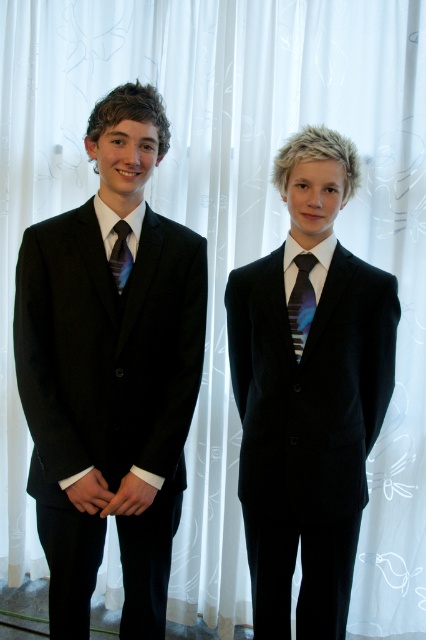
Question: Which point is closer to the camera?

Choices:
 (A) shiny blue tie at center
 (B) matte black suit at left
 (C) matte black tie at left

Answer: (B)

Question: Which point is farther to the camera?

Choices:
 (A) shiny blue tie at center
 (B) matte black suit at left
 (C) matte black suit at center

Answer: (A)

Question: Does matte black suit at left have a smaller size compared to shiny blue tie at center?

Choices:
 (A) no
 (B) yes

Answer: (A)

Question: Can you confirm if matte black suit at left is wider than matte black tie at left?

Choices:
 (A) yes
 (B) no

Answer: (A)

Question: Is matte black suit at left to the right of shiny blue tie at center from the viewer's perspective?

Choices:
 (A) no
 (B) yes

Answer: (A)

Question: Which of the following is the closest to the observer?

Choices:
 (A) matte black suit at left
 (B) matte black suit at center

Answer: (A)